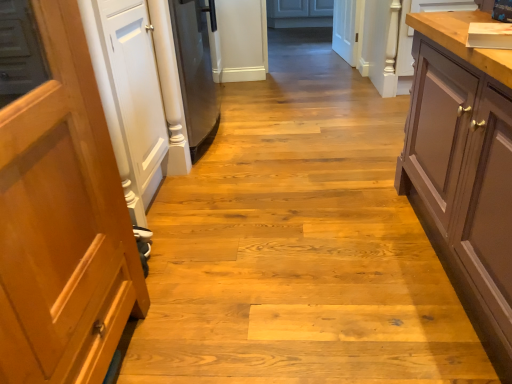
Question: Does matte brown cabinet at right have a smaller size compared to wooden countertop at upper right?

Choices:
 (A) yes
 (B) no

Answer: (B)

Question: Is wooden countertop at upper right at the back of matte brown cabinet at right?

Choices:
 (A) yes
 (B) no

Answer: (B)

Question: Can you confirm if matte brown cabinet at right is positioned to the right of wooden countertop at upper right?

Choices:
 (A) yes
 (B) no

Answer: (B)

Question: Is matte brown cabinet at right next to wooden countertop at upper right and touching it?

Choices:
 (A) no
 (B) yes

Answer: (A)

Question: From a real-world perspective, is matte brown cabinet at right under wooden countertop at upper right?

Choices:
 (A) no
 (B) yes

Answer: (A)

Question: Does matte brown cabinet at right have a greater height compared to wooden countertop at upper right?

Choices:
 (A) no
 (B) yes

Answer: (B)

Question: Considering the relative sizes of wooden countertop at upper right and matte brown cabinet at right in the image provided, is wooden countertop at upper right smaller than matte brown cabinet at right?

Choices:
 (A) yes
 (B) no

Answer: (A)

Question: Is wooden countertop at upper right not near matte brown cabinet at right?

Choices:
 (A) yes
 (B) no

Answer: (B)

Question: Is wooden countertop at upper right turned away from matte brown cabinet at right?

Choices:
 (A) yes
 (B) no

Answer: (B)

Question: Is wooden countertop at upper right to the left of matte brown cabinet at right from the viewer's perspective?

Choices:
 (A) yes
 (B) no

Answer: (B)

Question: From the image's perspective, is wooden countertop at upper right located beneath matte brown cabinet at right?

Choices:
 (A) yes
 (B) no

Answer: (B)

Question: From the image's perspective, would you say wooden countertop at upper right is positioned over matte brown cabinet at right?

Choices:
 (A) yes
 (B) no

Answer: (A)

Question: From their relative heights in the image, would you say wooden countertop at upper right is taller or shorter than matte brown cabinet at right?

Choices:
 (A) tall
 (B) short

Answer: (B)